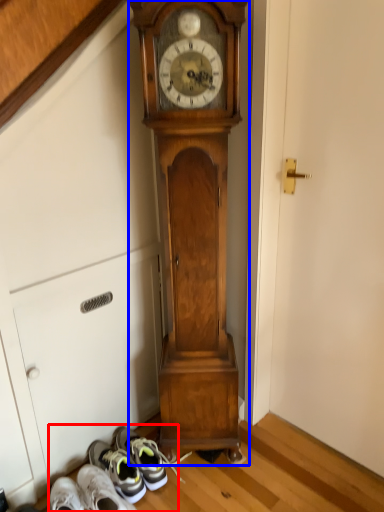
Question: Which point is further to the camera, shoe (highlighted by a red box) or wall clock (highlighted by a blue box)?

Choices:
 (A) shoe
 (B) wall clock

Answer: (A)